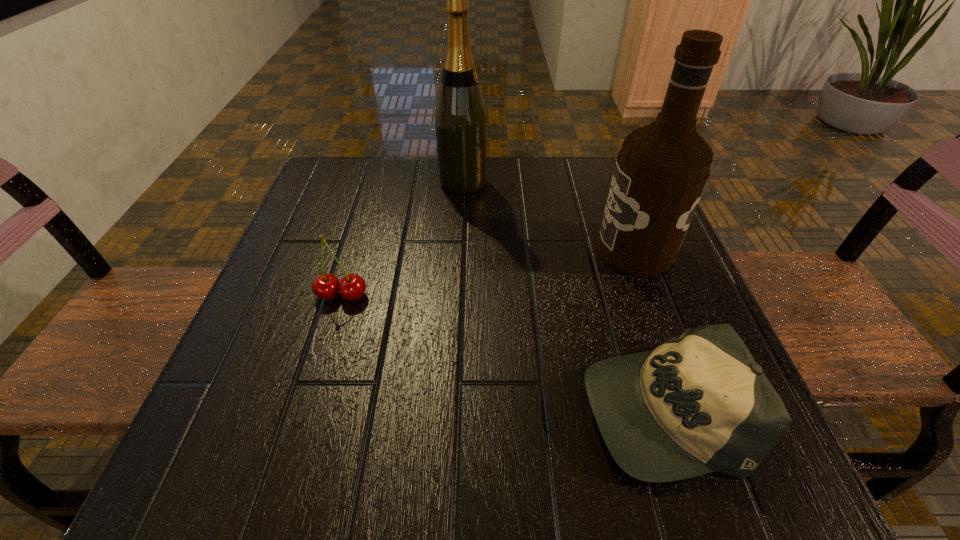
Locate an element on the screen. the second object from left to right is located at coordinates (460, 118).

Locate an element on the screen. This screenshot has width=960, height=540. wine bottle is located at coordinates (460, 118).

You are a GUI agent. You are given a task and a screenshot of the screen. Output one action in this format:
    pyautogui.click(x=<x>, y=<y>)
    Task: Click on the alcohol
    Image resolution: width=960 pixels, height=540 pixels.
    Given the screenshot: What is the action you would take?
    pyautogui.click(x=661, y=170)

Locate an element on the screen. cherry is located at coordinates coord(326,286).

Identify the location of the leftmost object. (326, 286).

Locate an element on the screen. the nearest object is located at coordinates (699, 403).

Locate an element on the screen. baseball cap is located at coordinates (699, 403).

Where is `free space located 0.220m on the front-facing side of the farthest object`? The width and height of the screenshot is (960, 540). free space located 0.220m on the front-facing side of the farthest object is located at coordinates (582, 183).

The width and height of the screenshot is (960, 540). I want to click on vacant position located 0.240m on the label of the third nearest object, so click(473, 249).

At what (x,y) coordinates should I click in order to perform the action: click on free location located on the label of the third nearest object. Please return your answer as a coordinate pair (x, y). Looking at the image, I should click on (452, 249).